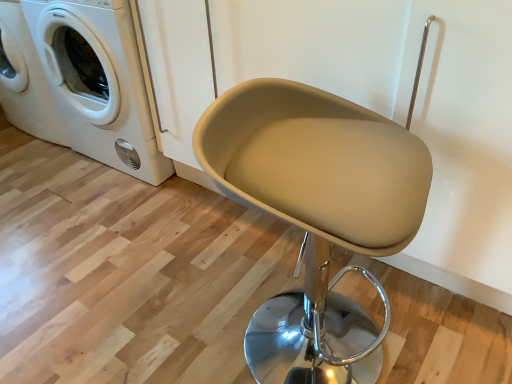
Question: Considering the relative sizes of white glossy washing machine at upper left and beige fabric swivel chair at center in the image provided, is white glossy washing machine at upper left shorter than beige fabric swivel chair at center?

Choices:
 (A) yes
 (B) no

Answer: (B)

Question: Is white glossy washing machine at upper left far from beige fabric swivel chair at center?

Choices:
 (A) yes
 (B) no

Answer: (A)

Question: From the image's perspective, does white glossy washing machine at upper left appear lower than beige fabric swivel chair at center?

Choices:
 (A) yes
 (B) no

Answer: (B)

Question: Is white glossy washing machine at upper left at the right side of beige fabric swivel chair at center?

Choices:
 (A) no
 (B) yes

Answer: (A)

Question: Does white glossy washing machine at upper left lie behind beige fabric swivel chair at center?

Choices:
 (A) no
 (B) yes

Answer: (B)

Question: Does white glossy washing machine at upper left contain beige fabric swivel chair at center?

Choices:
 (A) yes
 (B) no

Answer: (B)

Question: Is beige fabric swivel chair at center positioned beyond the bounds of white glossy washing machine at upper left?

Choices:
 (A) no
 (B) yes

Answer: (B)

Question: From a real-world perspective, does beige fabric swivel chair at center sit lower than white glossy washing machine at upper left?

Choices:
 (A) no
 (B) yes

Answer: (B)

Question: Is beige fabric swivel chair at center aimed at white glossy washing machine at upper left?

Choices:
 (A) no
 (B) yes

Answer: (A)

Question: From a real-world perspective, is beige fabric swivel chair at center over white glossy washing machine at upper left?

Choices:
 (A) yes
 (B) no

Answer: (B)

Question: Considering the relative sizes of beige fabric swivel chair at center and white glossy washing machine at upper left in the image provided, is beige fabric swivel chair at center taller than white glossy washing machine at upper left?

Choices:
 (A) no
 (B) yes

Answer: (A)

Question: Can you confirm if beige fabric swivel chair at center is positioned to the right of white glossy washing machine at upper left?

Choices:
 (A) no
 (B) yes

Answer: (B)

Question: Considering the positions of white glossy washing machine at upper left and beige fabric swivel chair at center in the image, is white glossy washing machine at upper left taller or shorter than beige fabric swivel chair at center?

Choices:
 (A) tall
 (B) short

Answer: (A)